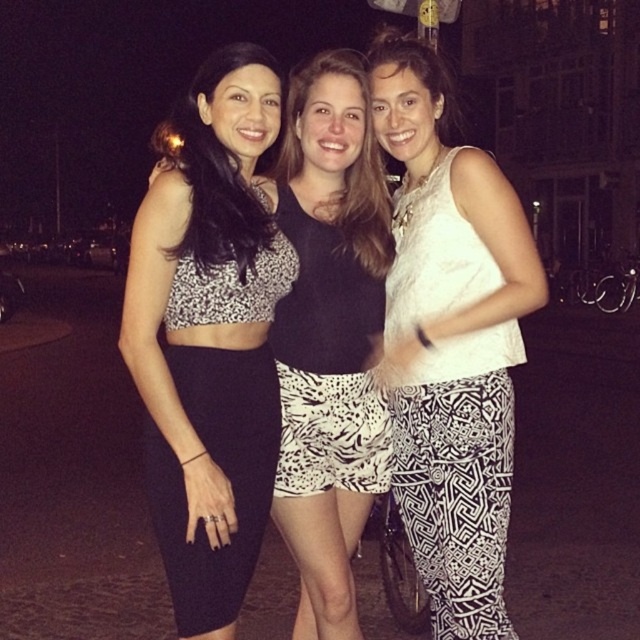
Does printed fabric crop top at center have a lesser width compared to white zebra-patterned shorts at center?

Incorrect, printed fabric crop top at center's width is not less than white zebra-patterned shorts at center's.

I want to click on printed fabric crop top at center, so click(330, 333).

Image resolution: width=640 pixels, height=640 pixels. Find the location of `printed fabric crop top at center`. printed fabric crop top at center is located at coordinates point(330,333).

You are a GUI agent. You are given a task and a screenshot of the screen. Output one action in this format:
    pyautogui.click(x=<x>, y=<y>)
    Task: Click on the printed fabric crop top at center
    The image size is (640, 640).
    Given the screenshot: What is the action you would take?
    pyautogui.click(x=330, y=333)

Can you confirm if white lace top at center is shorter than printed fabric crop top at center?

No.

Who is shorter, white lace top at center or printed fabric crop top at center?

With less height is printed fabric crop top at center.

Who is more distant from viewer, (436, 307) or (368, 336)?

Positioned behind is point (368, 336).

The height and width of the screenshot is (640, 640). In order to click on white lace top at center in this screenshot , I will do `click(451, 342)`.

Between point (266, 342) and point (317, 266), which one is positioned in front?

Point (266, 342)

Is black printed fabric dress at left thinner than white zebra-patterned shorts at center?

In fact, black printed fabric dress at left might be wider than white zebra-patterned shorts at center.

Is point (172, 285) positioned behind point (346, 388)?

No, (172, 285) is closer to viewer.

Where is `black printed fabric dress at left`? Image resolution: width=640 pixels, height=640 pixels. black printed fabric dress at left is located at coordinates (220, 426).